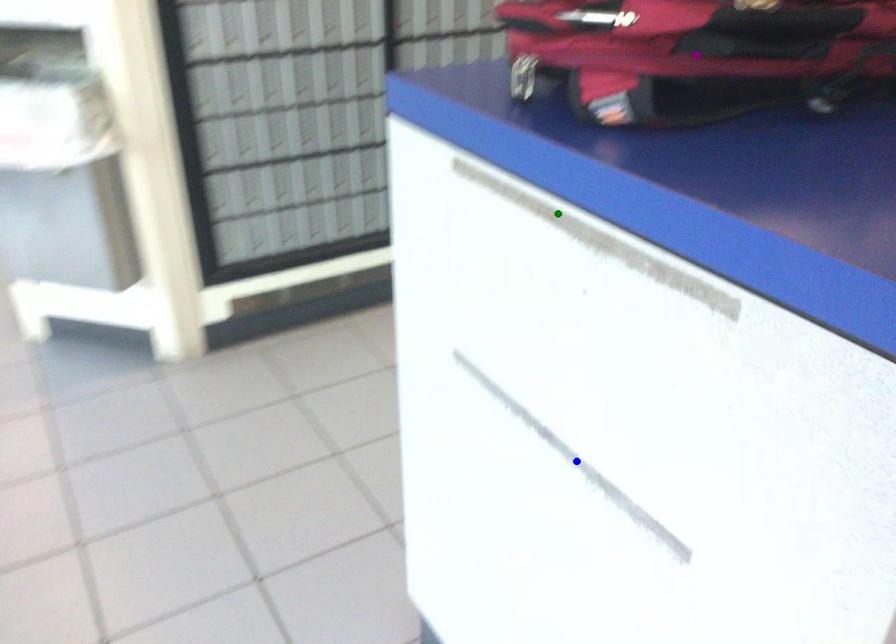
Order these from nearest to farthest:
blue point, purple point, green point

green point → purple point → blue point